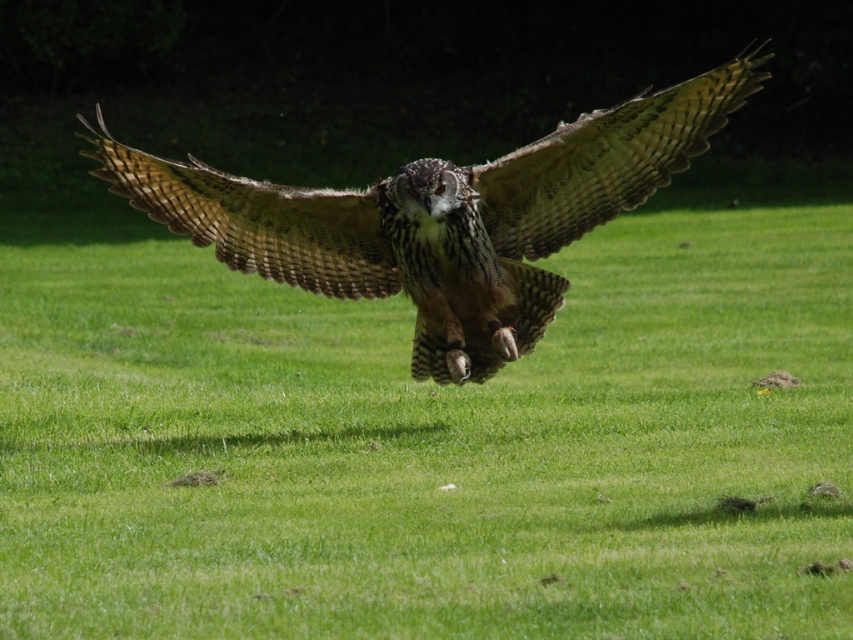
Question: Does green grassy field at center have a smaller size compared to brown feathered eagle at center?

Choices:
 (A) no
 (B) yes

Answer: (A)

Question: Among these points, which one is nearest to the camera?

Choices:
 (A) (764, 368)
 (B) (596, 216)

Answer: (B)

Question: Can you confirm if green grassy field at center is smaller than brown feathered eagle at center?

Choices:
 (A) yes
 (B) no

Answer: (B)

Question: Is green grassy field at center positioned at the back of brown feathered eagle at center?

Choices:
 (A) no
 (B) yes

Answer: (A)